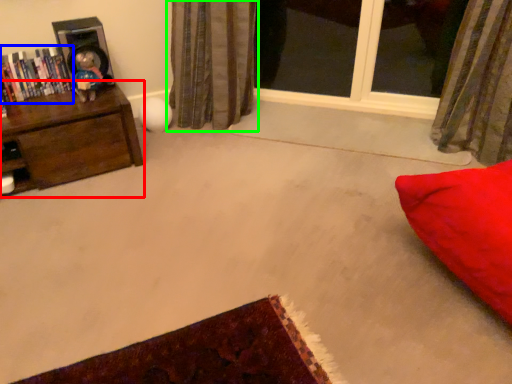
Question: Estimate the real-world distances between objects in this image. Which object is closer to furniture (highlighted by a red box), book (highlighted by a blue box) or curtain (highlighted by a green box)?

Choices:
 (A) book
 (B) curtain

Answer: (A)